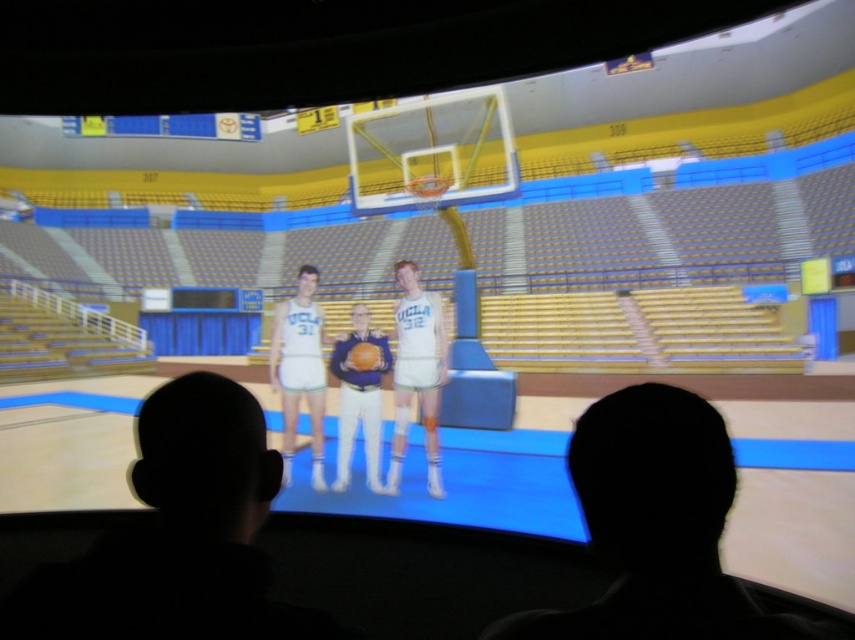
Does metallic gold basketball hoop at upper center come behind matte blue uniform at center?

Yes, metallic gold basketball hoop at upper center is behind matte blue uniform at center.

Is point (463, 179) positioned behind point (342, 470)?

Yes.

Between point (411, 100) and point (367, 452), which one is positioned in front?

Point (367, 452) is more forward.

Identify the location of metallic gold basketball hoop at upper center. (432, 152).

Between metallic gold basketball hoop at upper center and white matte basketball uniform at center, which one has less height?

white matte basketball uniform at center is shorter.

Based on the photo, how far apart are metallic gold basketball hoop at upper center and white matte basketball uniform at center?

A distance of 8.60 meters exists between metallic gold basketball hoop at upper center and white matte basketball uniform at center.

Is point (443, 104) positioned after point (435, 332)?

Yes, it is behind point (435, 332).

Find the location of a particular element. metallic gold basketball hoop at upper center is located at coordinates (432, 152).

Is white matte basketball uniform at center positioned before orange matte basketball at center?

Yes.

Is point (305, 276) positioned in front of point (366, 365)?

That is False.

Find the location of `white matte basketball uniform at center`. white matte basketball uniform at center is located at coordinates (358, 397).